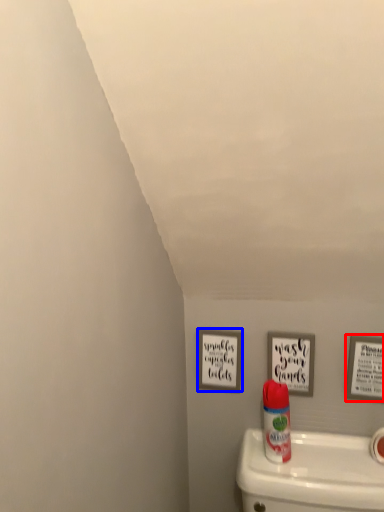
Question: Which object appears closest to the camera in this image, picture frame (highlighted by a red box) or picture frame (highlighted by a blue box)?

Choices:
 (A) picture frame
 (B) picture frame

Answer: (A)